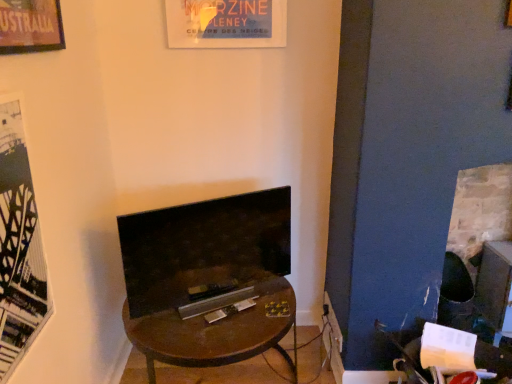
Question: In terms of height, does metallic silver magazine at center look taller or shorter compared to brown wooden desk at center?

Choices:
 (A) short
 (B) tall

Answer: (A)

Question: Looking at their shapes, would you say metallic silver magazine at center is wider or thinner than brown wooden desk at center?

Choices:
 (A) thin
 (B) wide

Answer: (A)

Question: Which object is the closest to the black matte poster at left?

Choices:
 (A) brick fireplace at right, positioned as the first fireplace in right-to-left order
 (B) brown wooden desk at center
 (C) matte black tv at center, which ranks as the 2th fireplace in right-to-left order
 (D) metallic silver magazine at center

Answer: (C)

Question: Which is farther from the matte black tv at center, which is counted as the first fireplace, starting from the left?

Choices:
 (A) brick fireplace at right, positioned as the first fireplace in right-to-left order
 (B) brown wooden desk at center
 (C) metallic silver magazine at center
 (D) black matte poster at left

Answer: (A)